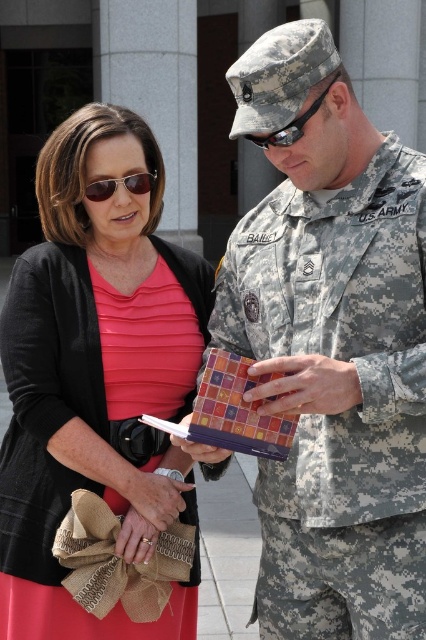
Question: Considering the real-world distances, which object is farthest from the matte black sunglasses at upper left?

Choices:
 (A) matte black clutch at left
 (B) reflective plastic goggles at center
 (C) camouflage uniform at center

Answer: (C)

Question: Is the position of matte black clutch at left more distant than that of matte black sunglasses at upper left?

Choices:
 (A) no
 (B) yes

Answer: (A)

Question: Is camouflage uniform at center to the right of reflective plastic goggles at center from the viewer's perspective?

Choices:
 (A) no
 (B) yes

Answer: (B)

Question: Which point appears farthest from the camera in this image?

Choices:
 (A) (97, 337)
 (B) (284, 141)

Answer: (A)

Question: Which object appears farthest from the camera in this image?

Choices:
 (A) reflective plastic goggles at center
 (B) camouflage uniform at center
 (C) matte black sunglasses at upper left

Answer: (C)

Question: In this image, where is reflective plastic goggles at center located relative to matte black sunglasses at upper left?

Choices:
 (A) right
 (B) left

Answer: (A)